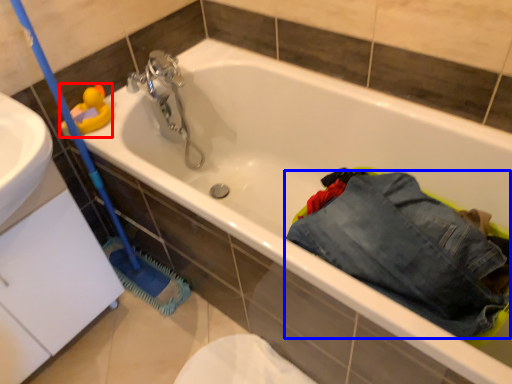
Question: Which point is closer to the camera, toy (highlighted by a red box) or trousers (highlighted by a blue box)?

Choices:
 (A) toy
 (B) trousers

Answer: (B)